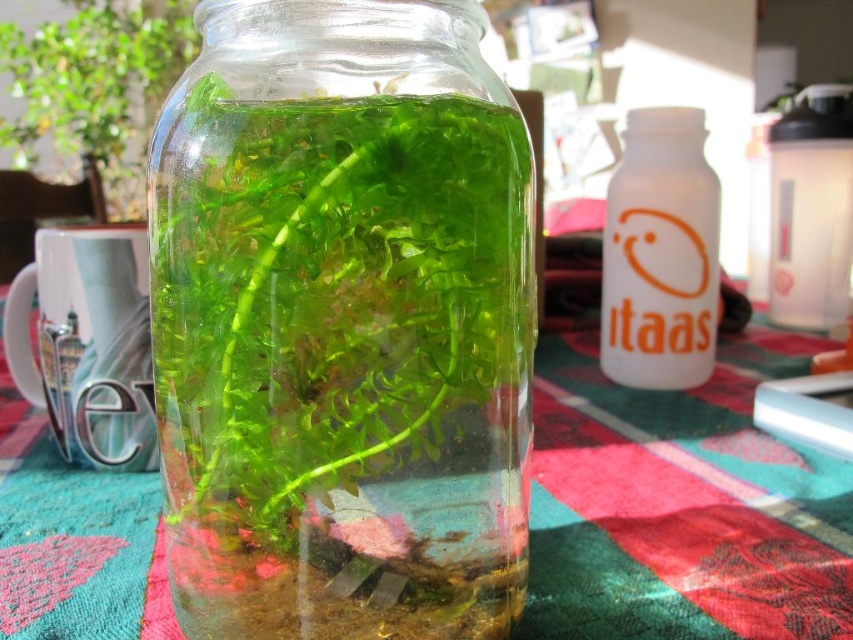
Question: Among these points, which one is nearest to the camera?

Choices:
 (A) (28, 140)
 (B) (332, 148)
 (C) (668, 145)

Answer: (B)

Question: Is transparent glass jar at center positioned in front of green matte plant at center?

Choices:
 (A) no
 (B) yes

Answer: (B)

Question: Where is white matte bottle at center-right located in relation to green matte plant at center in the image?

Choices:
 (A) left
 (B) right

Answer: (B)

Question: Among these points, which one is farthest from the camera?

Choices:
 (A) (790, 176)
 (B) (149, 538)
 (C) (397, 154)
 (D) (41, 100)

Answer: (D)

Question: Can you confirm if transparent glass jar at center is positioned to the left of translucent fabric tablecloth at center?

Choices:
 (A) no
 (B) yes

Answer: (B)

Question: Which object is the closest to the transparent plastic bottle at upper right?

Choices:
 (A) transparent glass jar at center
 (B) green matte plant at center
 (C) white matte bottle at center-right
 (D) translucent fabric tablecloth at center

Answer: (C)